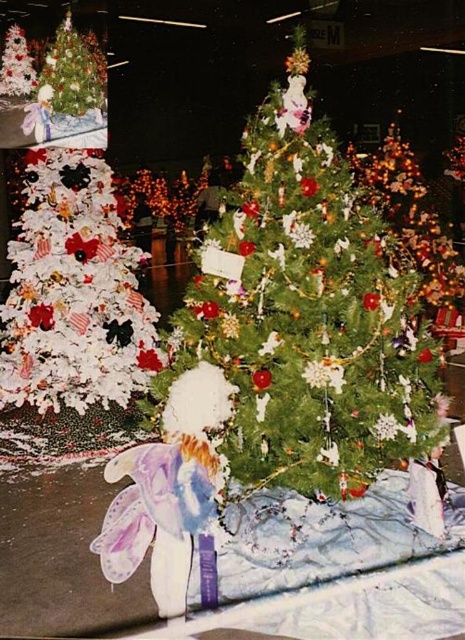
Does point (53, 348) come behind point (411, 177)?

No, (53, 348) is in front of (411, 177).

Does white matte christmas tree at left come behind shiny gold ornaments at center?

No, it is not.

Is point (1, 131) behind point (414, 196)?

No, (1, 131) is closer to viewer.

You are a GUI agent. You are given a task and a screenshot of the screen. Output one action in this format:
    pyautogui.click(x=<x>, y=<y>)
    Task: Click on the white matte christmas tree at left
    
    Given the screenshot: What is the action you would take?
    pyautogui.click(x=73, y=252)

Does green matte christmas tree at center have a greater width compared to white matte christmas tree at left?

Yes.

Which is behind, point (353, 483) or point (140, 344)?

Point (140, 344)

Locate an element on the screen. This screenshot has width=465, height=640. green matte christmas tree at center is located at coordinates click(307, 314).

Between green matte christmas tree at center and shiny gold ornaments at center, which one is positioned higher?

shiny gold ornaments at center

Between green matte christmas tree at center and shiny gold ornaments at center, which one appears on the right side from the viewer's perspective?

shiny gold ornaments at center is more to the right.

Is point (350, 403) positioned before point (420, 291)?

Yes.

The height and width of the screenshot is (640, 465). I want to click on green matte christmas tree at center, so click(307, 314).